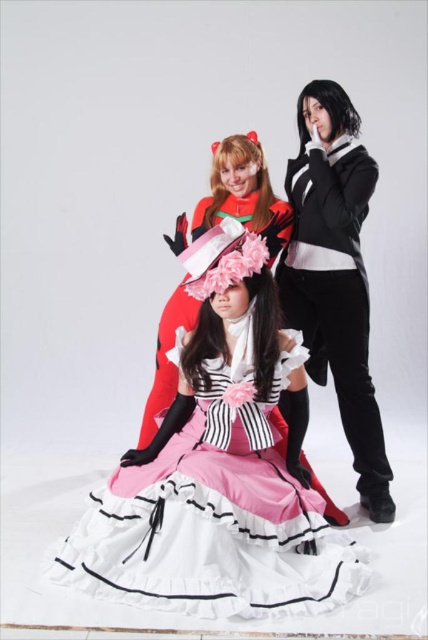
Question: Which object is closer to the camera taking this photo?

Choices:
 (A) black matte jacket at center
 (B) matte pink dress at center
 (C) matte black dress at center

Answer: (B)

Question: Among these objects, which one is nearest to the camera?

Choices:
 (A) black matte jacket at center
 (B) matte pink dress at center

Answer: (B)

Question: Can you confirm if black matte jacket at center is thinner than matte black dress at center?

Choices:
 (A) yes
 (B) no

Answer: (A)

Question: Is matte pink dress at center smaller than black matte jacket at center?

Choices:
 (A) no
 (B) yes

Answer: (A)

Question: Estimate the real-world distances between objects in this image. Which object is closer to the matte black dress at center?

Choices:
 (A) matte pink dress at center
 (B) black matte jacket at center

Answer: (B)

Question: In this image, where is black matte jacket at center located relative to matte black dress at center?

Choices:
 (A) left
 (B) right

Answer: (B)